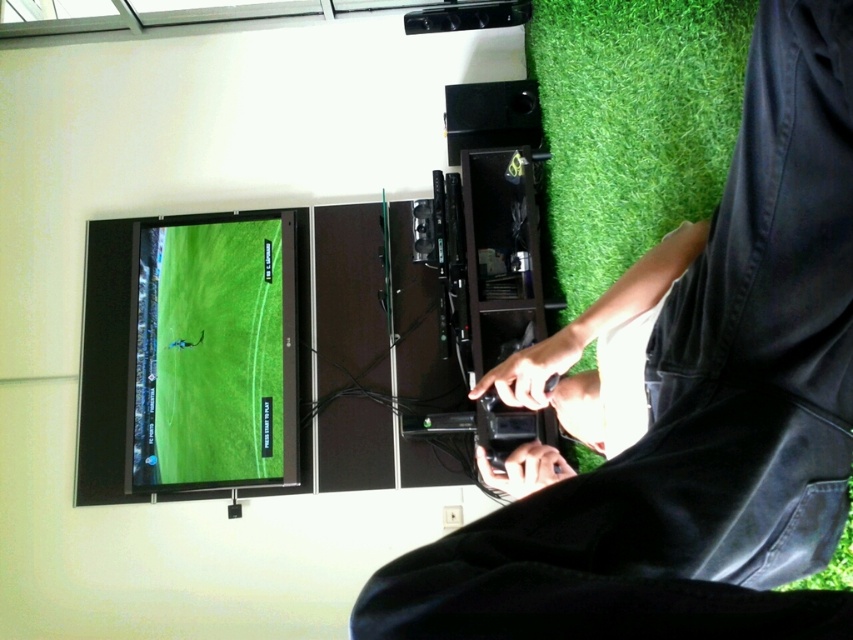
You are setting up a new gaming setup. You have the green matte screen at left and the black matte controller at lower center. Where should you place the controller relative to the screen to match the image?

The black matte controller at lower center should be placed above the green matte screen at left to match the image, as the screen is located below the controller in the scene.

From the picture: You are setting up a new gaming setup. You have a green matte screen at left and a black matte controller at lower center. Which object should you place higher to ensure proper visibility and ergonomics?

The green matte screen at left should be placed higher since it is much taller than the black matte controller at lower center, ensuring it is at an optimal viewing height while keeping the controller within comfortable reach.

You are a game developer observing the scene. You need to place a new game manual on the table so that it is between the black matte pants at lower right and the black matte controller at lower center. Is this possible based on their positions?

The black matte pants at lower right is located below the black matte controller at lower center. Since the pants are below the controller, there is no space between them for placing the manual. Therefore, it is not possible to place the manual between them in this arrangement.